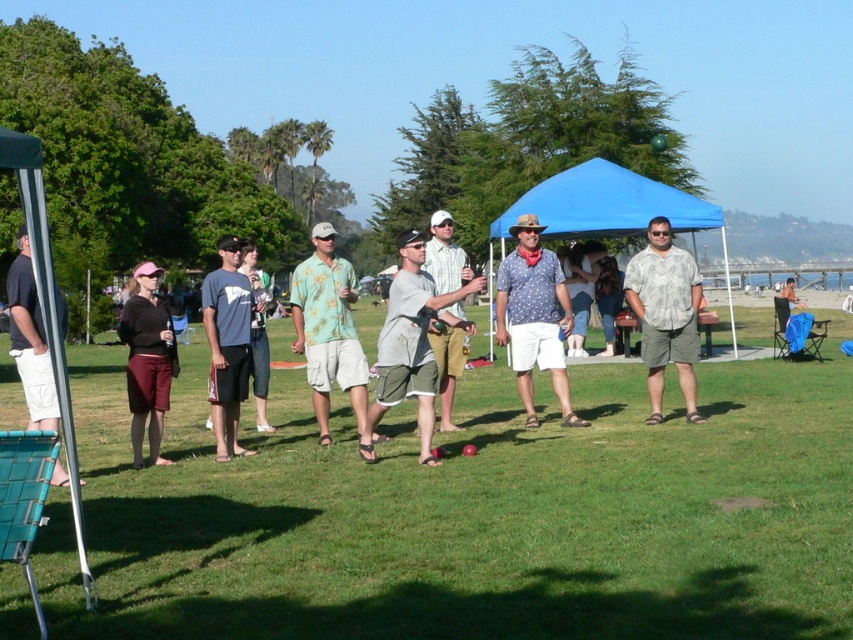
You are planning to set up a picnic blanket in the park. The picnic blanket is the size of the patterned cotton shirt at center. Will the green grass at center provide enough space for the blanket?

The green grass at center is bigger than the patterned cotton shirt at center, so yes, the green grass at center has enough space to accommodate the picnic blanket.

You are planning to install a new bench in the park between the blue fabric canopy at center and the patterned cotton shirt at center. The bench requires a minimum of 7 meters of space. Can the bench be placed there?

The distance between the blue fabric canopy at center and the patterned cotton shirt at center is 6.94 meters, which is slightly less than the required 7 meters. Therefore, the bench cannot be placed there.

You are standing at the edge of the green grass at center and want to place a small red ball on the patterned cotton shirt at center. Is this possible based on their positions?

The green grass at center is below the patterned cotton shirt at center, so placing the ball on the shirt would require lifting it above the grass since the shirt is higher up.